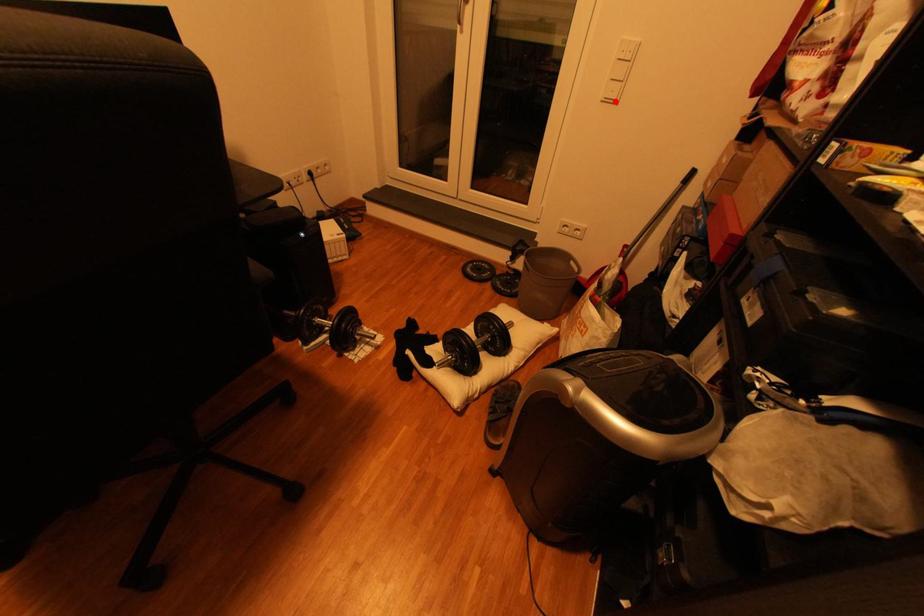
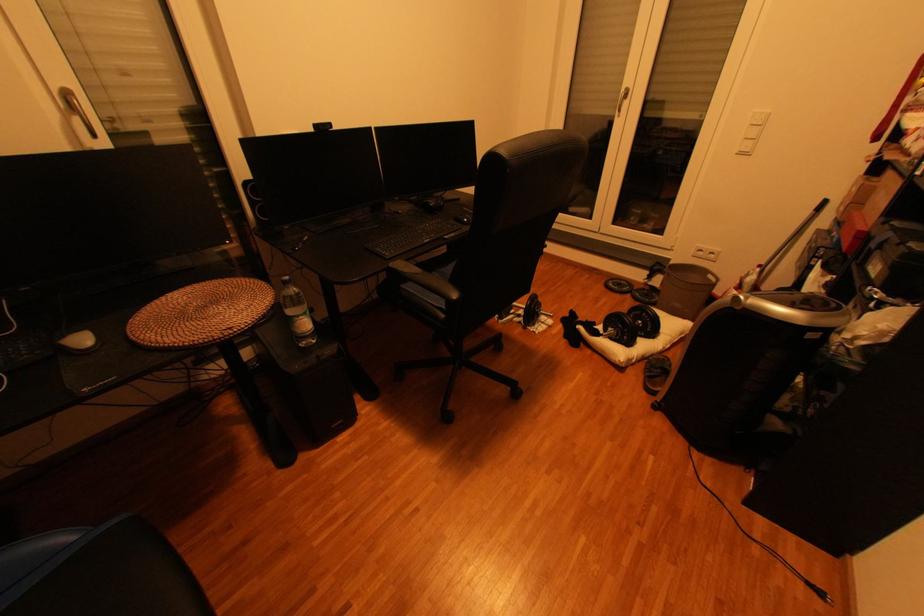
In the second image, find the point that corresponds to the highlighted location in the first image.

(749, 155)